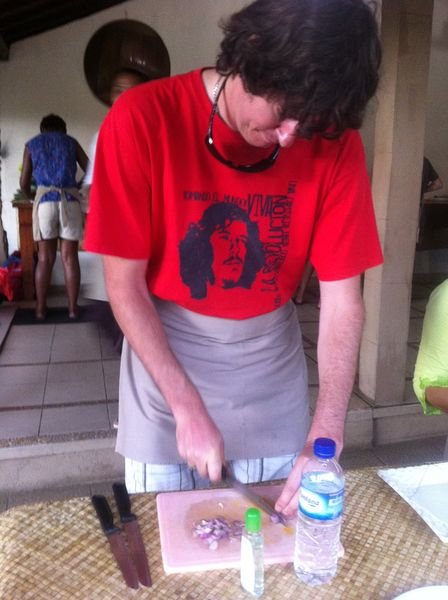
At what (x,y) coordinates should I click in order to perform the action: click on counter area. Please return your answer as a coordinate pair (x, y). This screenshot has height=600, width=448. Looking at the image, I should click on (47, 555).